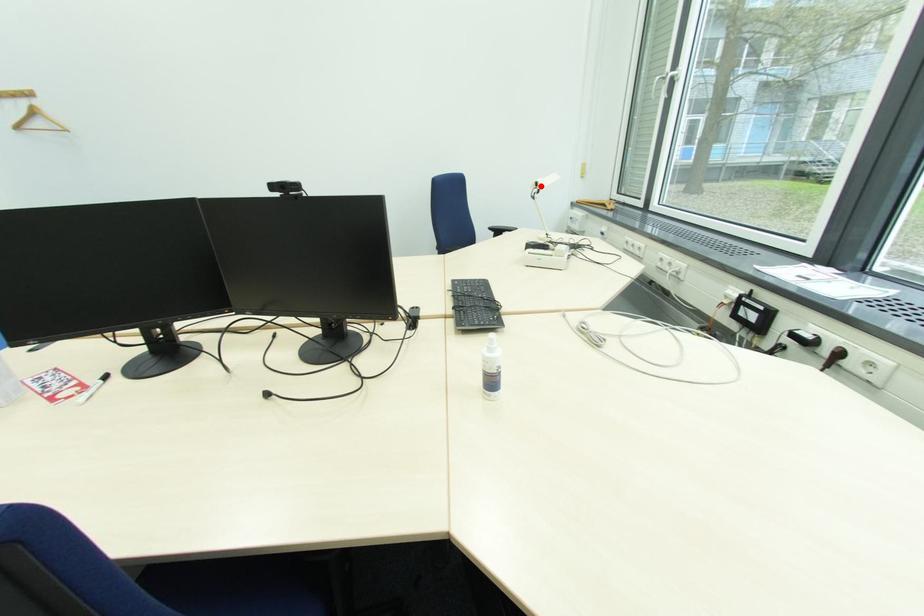
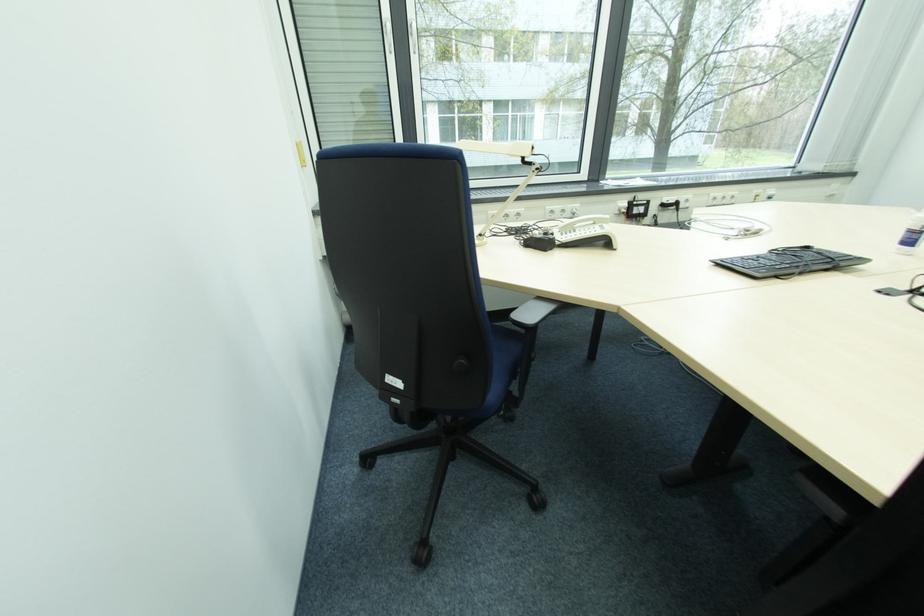
Question: I am providing you with two images of the same scene from different viewpoints. A red point is marked on the first image. At the location where the point appears in image 1, is it still visible in image 2?

Choices:
 (A) Yes
 (B) No

Answer: (A)